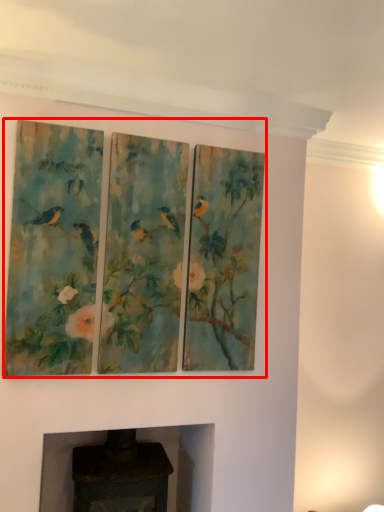
Question: From the image's perspective, what is the correct spatial relationship of oil painting (annotated by the red box) in relation to fireplace?

Choices:
 (A) below
 (B) above

Answer: (B)